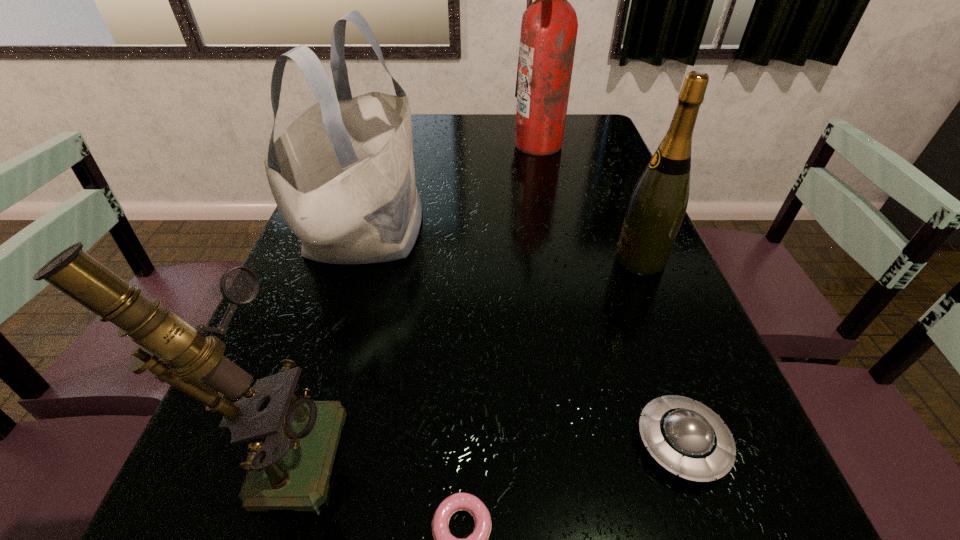
I want to click on fire extinguisher, so click(549, 26).

Locate an element on the screen. Image resolution: width=960 pixels, height=540 pixels. the tallest object is located at coordinates (549, 26).

I want to click on shopping bag, so click(342, 174).

Find the location of a particular element. Image resolution: width=960 pixels, height=540 pixels. wine bottle is located at coordinates (658, 203).

The image size is (960, 540). What are the coordinates of `microscope` in the screenshot? It's located at (294, 440).

The width and height of the screenshot is (960, 540). Identify the location of saucer. (687, 438).

Find the location of a particular element. This screenshot has width=960, height=540. vacant space located 0.160m on the front of the fire extinguisher near the operation label is located at coordinates (465, 144).

Find the location of a particular element. free region located on the front of the fire extinguisher near the operation label is located at coordinates (474, 144).

Where is `vacant region located 0.150m on the front of the fire extinguisher near the operation label`? vacant region located 0.150m on the front of the fire extinguisher near the operation label is located at coordinates (468, 144).

Where is `free space located 0.250m on the front of the shopping bag`? The height and width of the screenshot is (540, 960). free space located 0.250m on the front of the shopping bag is located at coordinates (307, 417).